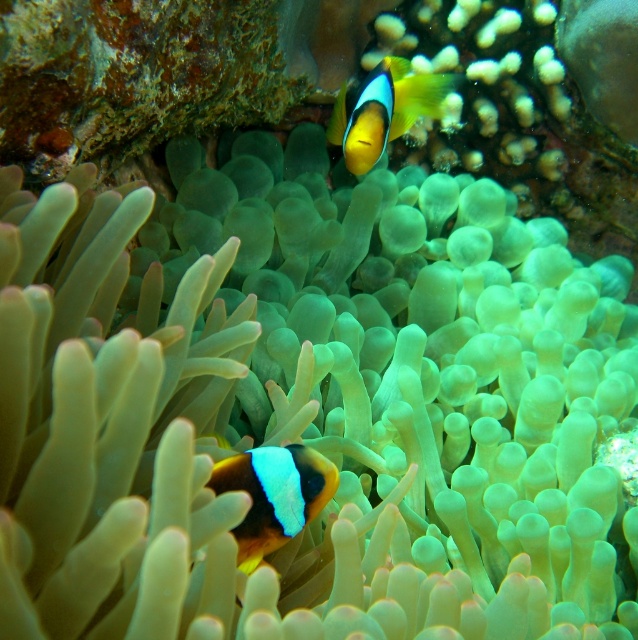
You are a marine biologist observing two clownfish in an underwater scene. You notice an orange and white clownfish at center and a yellow matte clownfish at upper center. Which of these two clownfish has a smaller body width?

The orange and white clownfish at center has a smaller body width compared to the yellow matte clownfish at upper center because it is thinner than the yellow matte clownfish at upper center.

You are a diver swimming in the underwater scene. You want to reach a point that is exactly 1.18 meters away from you. Can you reach the point at coordinates point (315, 456)?

The point at coordinates point (315, 456) is exactly 1.18 meters away from the camera, so yes, you can reach the point at coordinates point (315, 456).